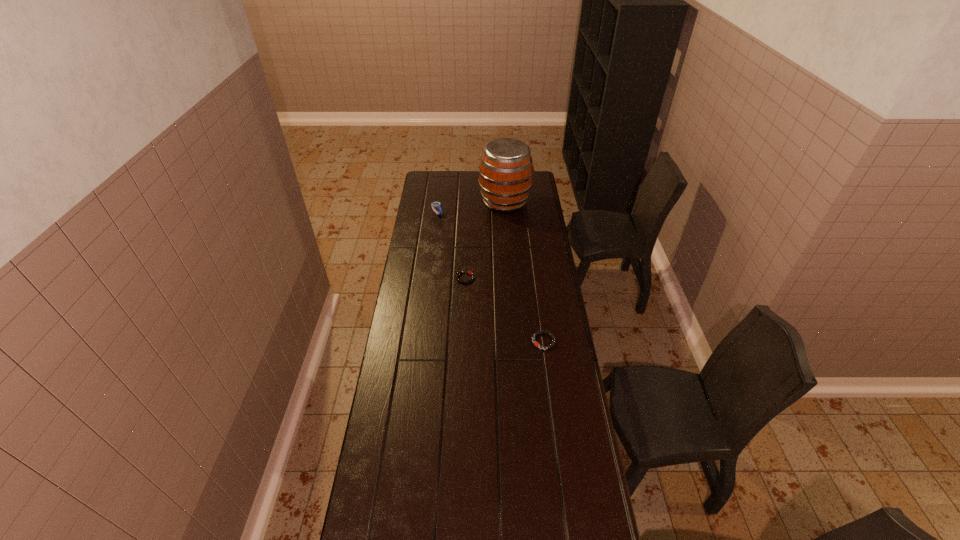
The width and height of the screenshot is (960, 540). I want to click on cider, so click(x=505, y=172).

Find the location of a particular element. the leftmost object is located at coordinates (434, 204).

Image resolution: width=960 pixels, height=540 pixels. I want to click on the second tallest object, so click(x=434, y=204).

Find the location of a particular element. The image size is (960, 540). the nearest object is located at coordinates click(536, 333).

Image resolution: width=960 pixels, height=540 pixels. I want to click on the nearer bracelet, so click(x=536, y=333).

Where is `the farther bracelet`? This screenshot has height=540, width=960. the farther bracelet is located at coordinates (469, 272).

The width and height of the screenshot is (960, 540). Identify the location of the left bracelet. (469, 272).

Where is `free location located on the back of the tallest object`? The image size is (960, 540). free location located on the back of the tallest object is located at coordinates (502, 172).

Where is `free location located on the back of the watch`? Image resolution: width=960 pixels, height=540 pixels. free location located on the back of the watch is located at coordinates (439, 202).

Locate an element on the screen. The image size is (960, 540). vacant space situated on the back of the right bracelet is located at coordinates (535, 274).